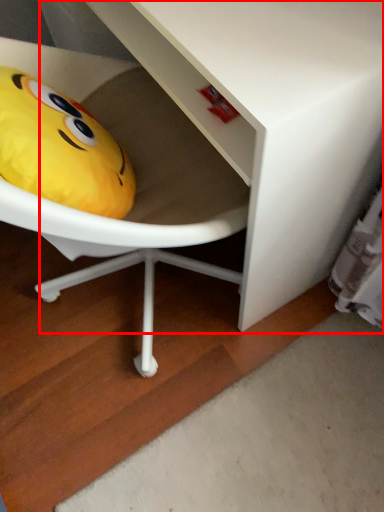
Question: Considering the relative positions of vanity (annotated by the red box) and toy in the image provided, where is vanity (annotated by the red box) located with respect to the staircase?

Choices:
 (A) left
 (B) right

Answer: (B)